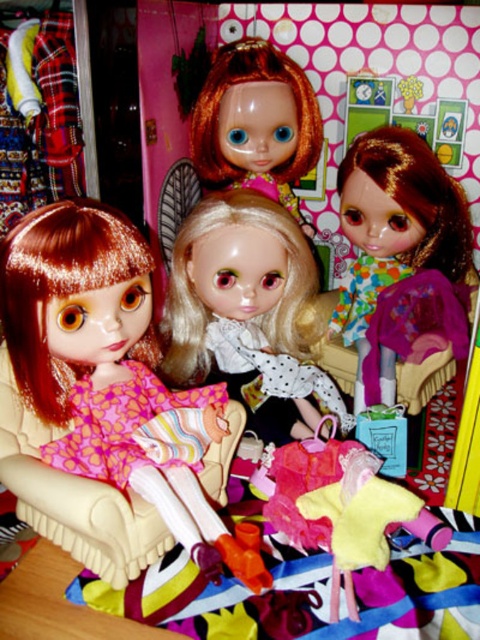
From the picture: You are a toy organizer trying to arrange dolls in a display case. You have two dolls in front of you, one with a shiny blonde wig at center and another with a matte pink fabric dress at center. Based on their positions in the image, which doll should you place in front to maintain the original scene layout?

The shiny blonde wig at center should be placed in front because the matte pink fabric dress at center is positioned behind it in the original scene.

You are a toy organizer trying to stack these two items vertically. Given the height difference between the shiny blonde wig at center and the matte pink fabric dress at center, which one should be placed at the bottom to ensure stability?

The shiny blonde wig at center is taller than the matte pink fabric dress at center, so placing the taller shiny blonde wig at center at the bottom would provide better stability for the stack.